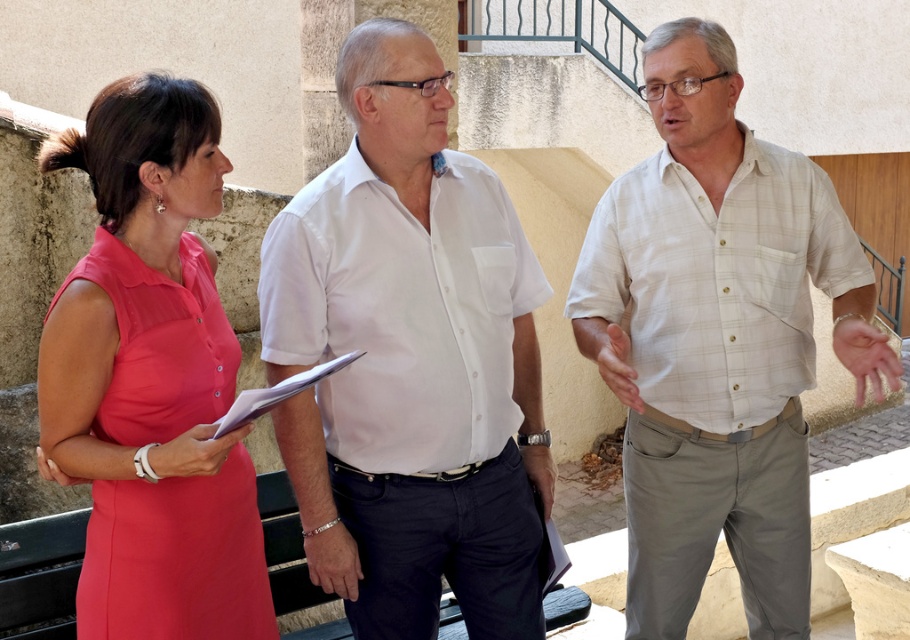
Based on the scene description, can you determine which object is positioned higher in the image between the light beige plaid shirt at center and the satin pink dress at left?

The light beige plaid shirt at center is positioned higher than the satin pink dress at left in the image.

You are a photographer trying to capture a candid shot of the satin pink dress at left and the white paper clipboard at center. Based on their positions, can you tell me which one is closer to the bottom edge of the photo?

The satin pink dress at left is located below the white paper clipboard at center, so it is closer to the bottom edge of the photo.